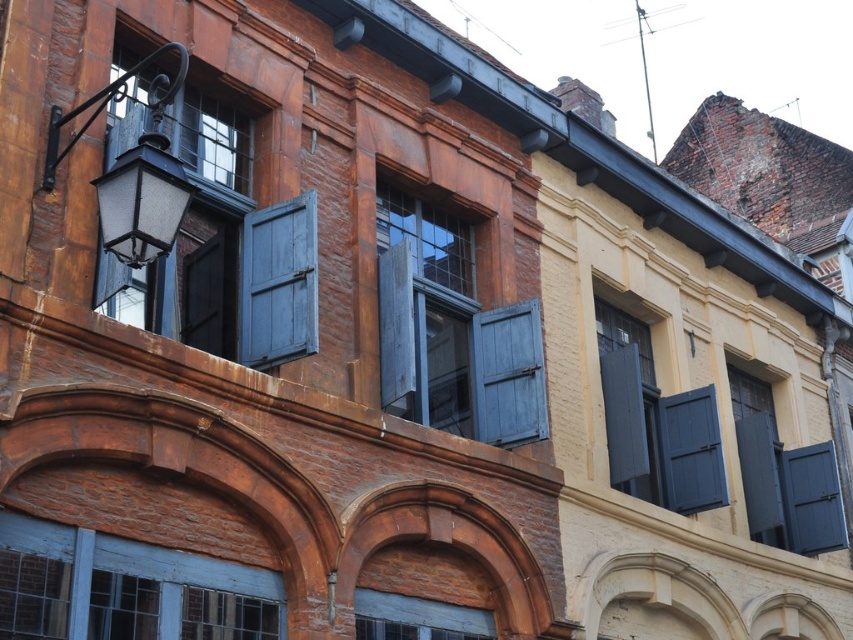
Between matte black lantern at upper left and dark blue wood shutter at lower right, which one is positioned lower?

dark blue wood shutter at lower right

Based on the photo, between matte black lantern at upper left and dark blue wood shutter at lower right, which one is positioned higher?

matte black lantern at upper left

At what (x,y) coordinates should I click in order to perform the action: click on matte black lantern at upper left. Please return your answer as a coordinate pair (x, y). Image resolution: width=853 pixels, height=640 pixels. Looking at the image, I should click on (132, 170).

Identify the location of matte black lantern at upper left. coord(132,170).

Is point (425, 413) positioned in front of point (172, 220)?

That is False.

Does point (410, 412) lie behind point (128, 243)?

Yes, it is.

Between point (486, 422) and point (132, 172), which one is positioned in front?

Point (132, 172) is in front.

Locate an element on the screen. wooden window at center is located at coordinates (451, 330).

Which is more to the right, blue painted wood window at lower left or matte dark blue shutter at center right?

matte dark blue shutter at center right is more to the right.

Find the location of `blue painted wood window at lower left`. blue painted wood window at lower left is located at coordinates (125, 588).

The width and height of the screenshot is (853, 640). What are the coordinates of `blue painted wood window at lower left` in the screenshot? It's located at (125, 588).